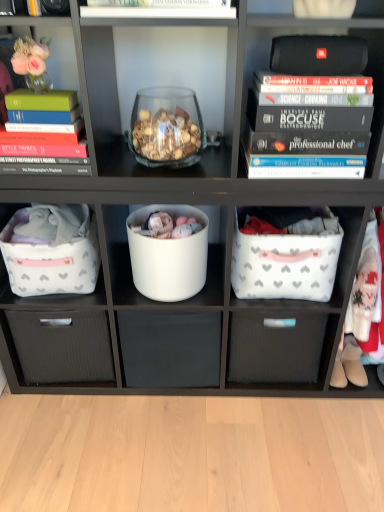
Question: Considering the positions of point (168, 367) and point (201, 247), is point (168, 367) closer or farther from the camera than point (201, 247)?

Choices:
 (A) closer
 (B) farther

Answer: (B)

Question: Considering the positions of white matte drawer at center, placed as the 2th drawer when sorted from right to left, and white matte bucket at center in the image, is white matte drawer at center, placed as the 2th drawer when sorted from right to left, taller or shorter than white matte bucket at center?

Choices:
 (A) short
 (B) tall

Answer: (B)

Question: Estimate the real-world distances between objects in this image. Which object is farther from the black hardcover books at upper right?

Choices:
 (A) translucent glass bowl at center
 (B) white fabric laundry basket at center right, which is the second laundry basket from left to right
 (C) black matte speaker at upper right
 (D) white fabric laundry basket at left, the 2th laundry basket from the right
 (E) white matte drawer at center, the first drawer when ordered from left to right

Answer: (E)

Question: Which object is positioned farthest from the black matte speaker at upper right?

Choices:
 (A) white fabric laundry basket at left, placed as the 1th laundry basket when sorted from left to right
 (B) translucent glass bowl at center
 (C) black hardcover books at upper right
 (D) matte green hardcover book at left
 (E) white matte bucket at center

Answer: (A)